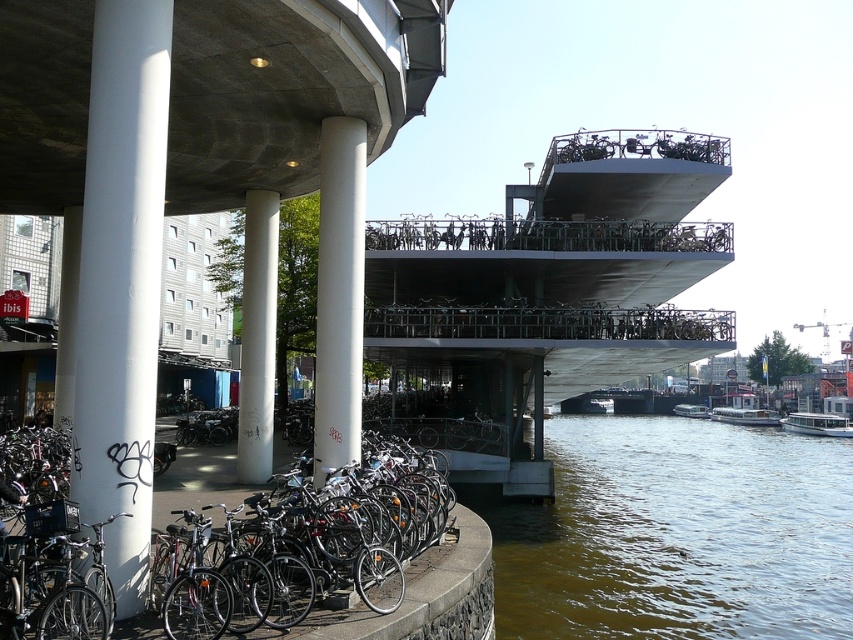
You are a cyclist trying to park your bicycle near the riverbank. You see the white smooth concrete pillar at left and the shiny metallic bicycle at lower left. Which object is positioned higher in the image?

The white smooth concrete pillar at left is located above the shiny metallic bicycle at lower left, so it is positioned higher in the image.

You are a delivery person who needs to move a 6 feet long box from the shiny metallic bicycle at lower left to the white smooth concrete pillar at center. Can you carry the box horizontally without tilting it while moving it from the bicycle to the pillar?

The distance between the white smooth concrete pillar at center and the shiny metallic bicycle at lower left is 15.28 feet. Since the box is 6 feet long, there is sufficient space to carry it horizontally without tilting. The 15.28 feet distance allows for easy maneuvering as the box length is much shorter than the available space.